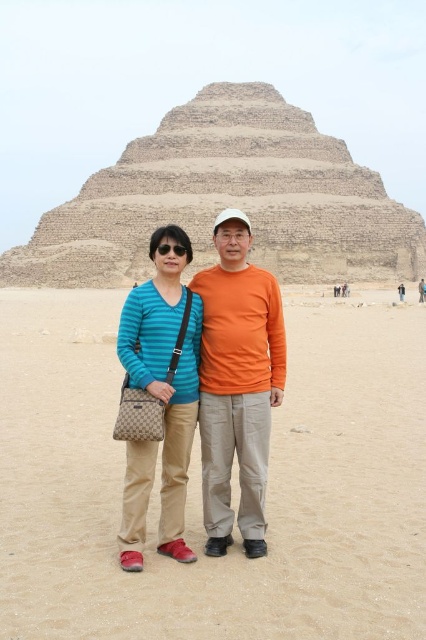
You are a tourist standing in front of the Step Pyramid of Djoser at Saqqara, Egypt. You see the beige sand at center and the orange cotton shirt at center. Which object is positioned to the left of the other?

The beige sand at center is to the left of the orange cotton shirt at center.

You are standing in front of the Step Pyramid of Djoser at Saqqara, Egypt. You see two points marked in the scene. The first point is at coordinate point(275, 109) and the second point is at coordinate point(178, 401). Which point is closer to you?

Point(275, 109) is further to the camera than point(178, 401), so the point closer to you is point(178, 401).

You are a photographer planning to take a photo of the Step Pyramid of Djoser. You notice the beige sand at center and the orange cotton shirt at center in the foreground. Which object would you focus on to ensure the subject with the larger size in the frame is sharp?

The beige sand at center has a larger size compared to the orange cotton shirt at center, so focusing on the beige sand at center would ensure the larger subject is sharp in the photo.